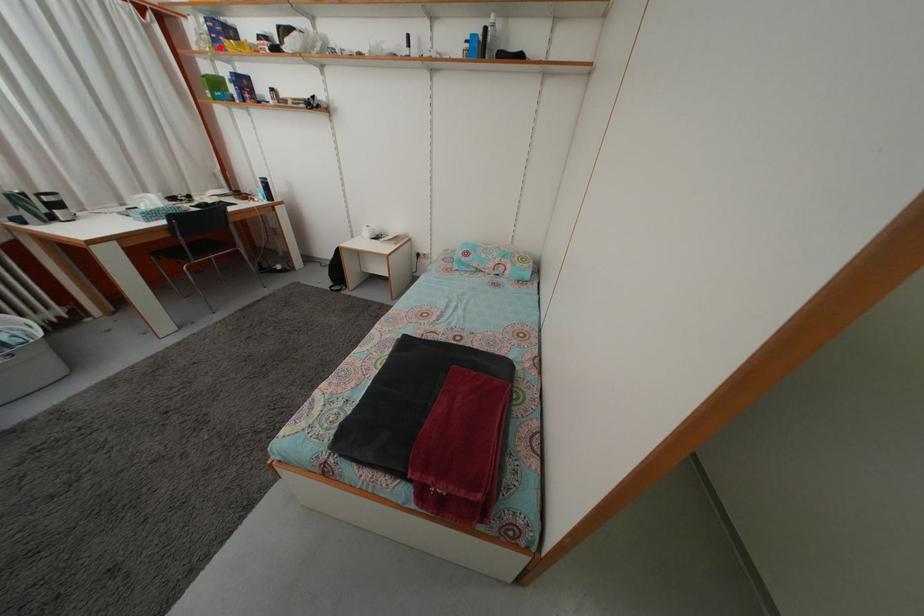
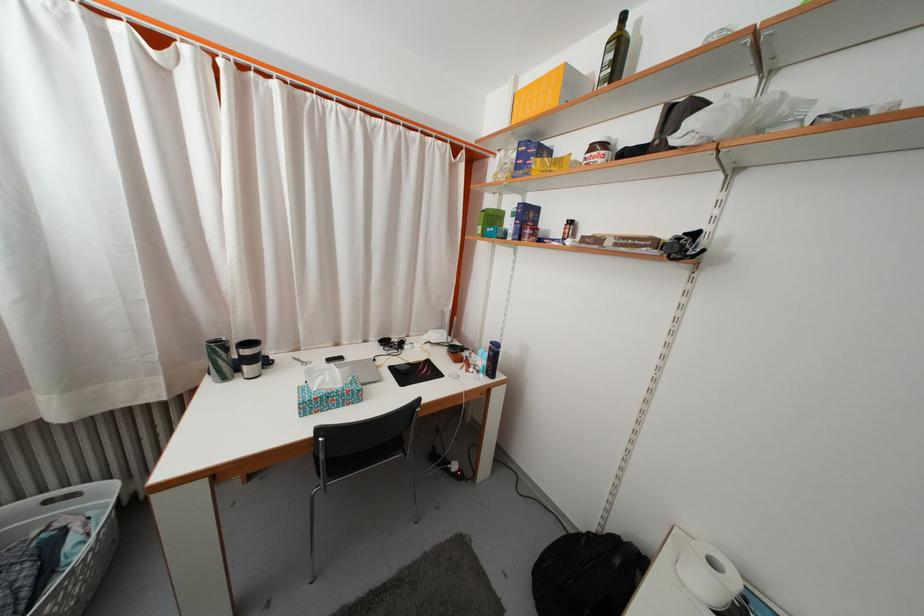
The point at the highlighted location is marked in the first image. Where is the corresponding point in the second image?

(523, 175)